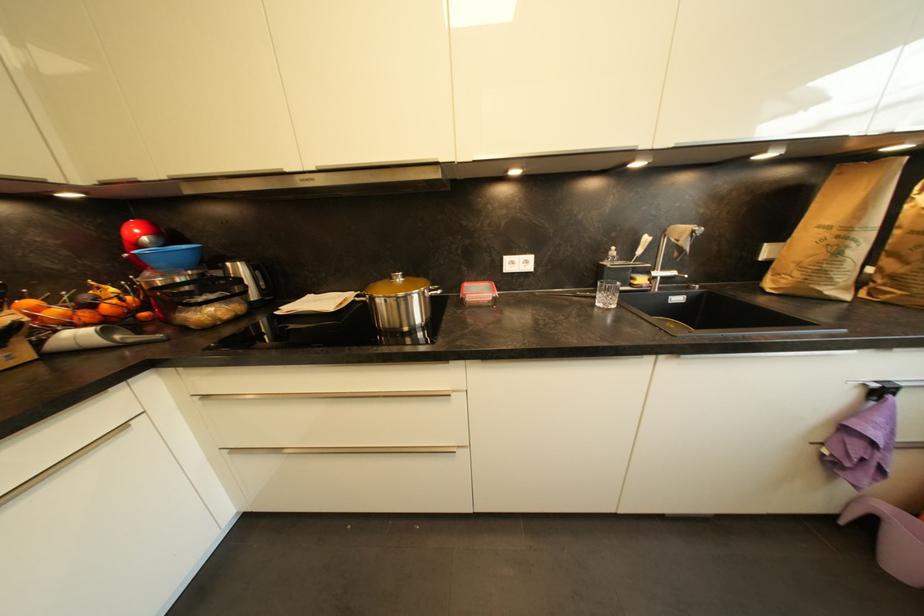
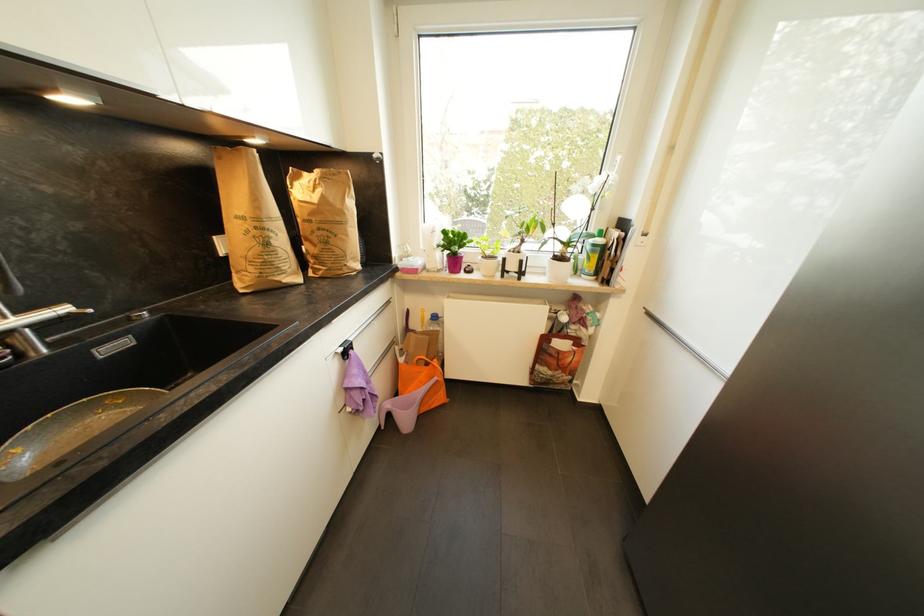
Based on the continuous images, in which direction is the camera rotating?

The camera rotated toward right-down.